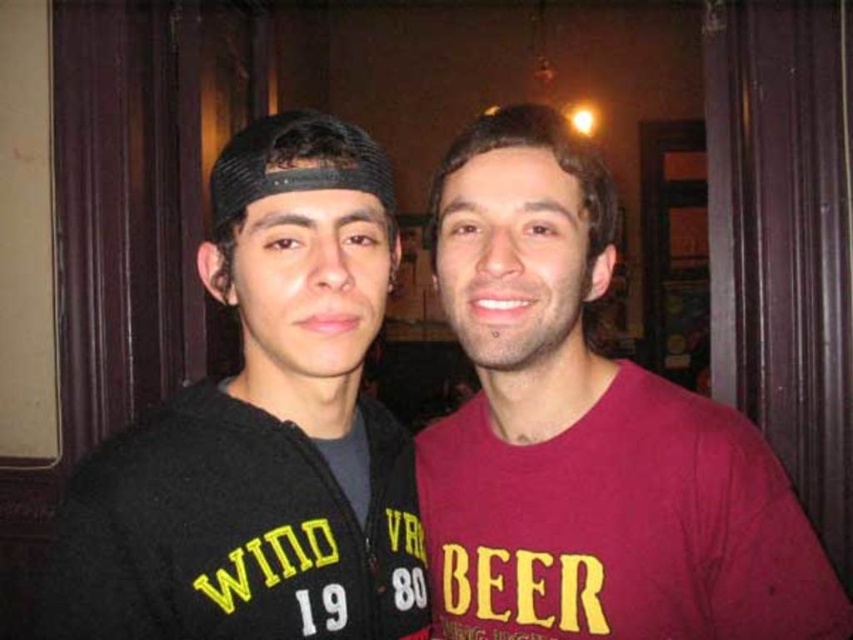
Question: Which object is farther from the camera taking this photo?

Choices:
 (A) black fleece jacket at left
 (B) black knitted cap at center

Answer: (B)

Question: Where is maroon cotton t-shirt at center located in relation to black knitted cap at center in the image?

Choices:
 (A) below
 (B) above

Answer: (A)

Question: Considering the relative positions of black fleece jacket at left and black knitted cap at center in the image provided, where is black fleece jacket at left located with respect to black knitted cap at center?

Choices:
 (A) right
 (B) left

Answer: (A)

Question: Can you confirm if maroon cotton t-shirt at center is wider than black fleece jacket at left?

Choices:
 (A) yes
 (B) no

Answer: (A)

Question: Considering the real-world distances, which object is closest to the black fleece jacket at left?

Choices:
 (A) maroon cotton t-shirt at center
 (B) black knitted cap at center

Answer: (B)

Question: Estimate the real-world distances between objects in this image. Which object is farther from the maroon cotton t-shirt at center?

Choices:
 (A) black knitted cap at center
 (B) black fleece jacket at left

Answer: (A)